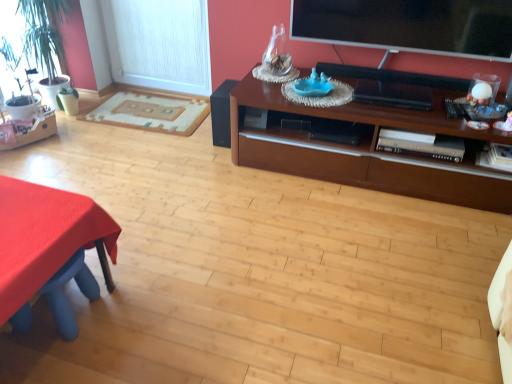
Find the location of a particular element. This screenshot has height=384, width=512. vacant space that's between green leafy plant at left and beige woven rug at left is located at coordinates (110, 125).